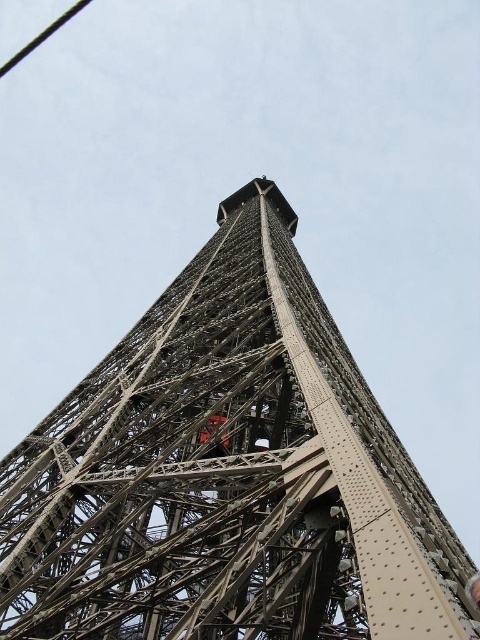
You are a photographer planning to capture the Eiffel Tower from this angle. You notice the metallic steel tower at center and the black wire at upper left in your viewfinder. Which object will appear bigger in your photo?

The metallic steel tower at center will appear bigger in your photo because it has a larger size compared to the black wire at upper left.

In the scene shown: You are a drone operator planning to fly a drone between the metallic steel tower at center and the black wire at upper left. The drone has a maximum flight distance of 250 meters. Based on the scene, can the drone safely complete the flight between these two points without exceeding its range?

The metallic steel tower at center and black wire at upper left are 276.76 meters apart, which exceeds the drone maximum flight distance of 250 meters. Therefore, the drone cannot safely complete the flight between these two points without exceeding its range.

You are a photographer planning to capture the Eiffel Tower from this angle. You notice the metallic steel tower at center and the black wire at upper left in your frame. Which object appears wider in your photo?

The metallic steel tower at center appears wider than the black wire at upper left because its width surpasses the black wire at upper left.